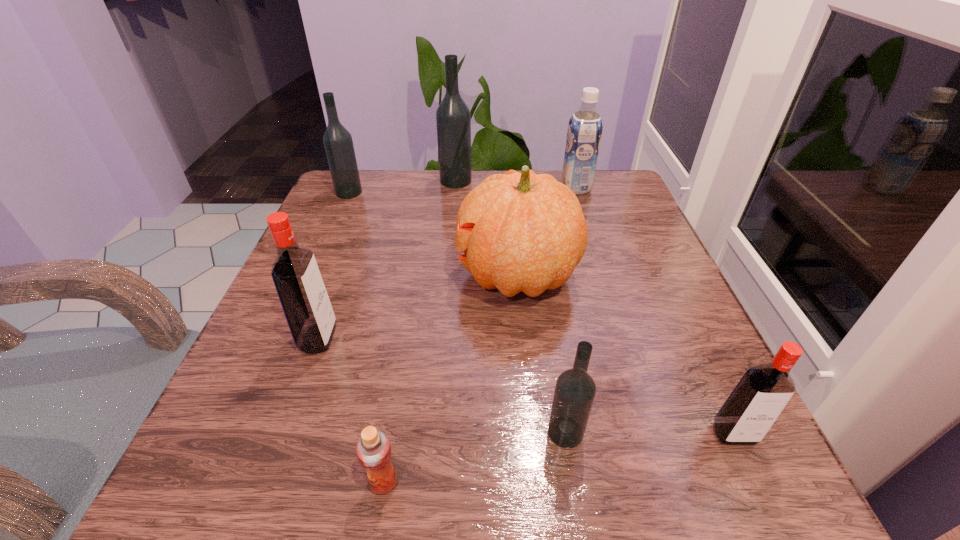
At what (x,y) coordinates should I click in order to perform the action: click on the smaller red vodka. Please return your answer as a coordinate pair (x, y). This screenshot has height=540, width=960. Looking at the image, I should click on (762, 393).

At what (x,y) coordinates should I click in order to perform the action: click on the right red vodka. Please return your answer as a coordinate pair (x, y). Looking at the image, I should click on (762, 393).

Identify the location of the nearest object. (373, 449).

Where is `the shortest object`? This screenshot has width=960, height=540. the shortest object is located at coordinates (373, 449).

This screenshot has height=540, width=960. Find the location of `free space located on the right of the third vodka from right to left`. free space located on the right of the third vodka from right to left is located at coordinates (534, 181).

Find the location of a particular element. vacant space located 0.140m on the label of the soya milk is located at coordinates (506, 188).

Find the location of a particular element. This screenshot has width=960, height=540. blank space located 0.400m on the label of the soya milk is located at coordinates (402, 188).

Where is `vacant area situated on the label of the soya milk`? vacant area situated on the label of the soya milk is located at coordinates (426, 188).

This screenshot has height=540, width=960. I want to click on vacant area situated 0.280m on the carved face of the fourth farthest object, so click(x=314, y=274).

Image resolution: width=960 pixels, height=540 pixels. What are the coordinates of `vacant region located on the carved face of the fourth farthest object` in the screenshot? It's located at (421, 274).